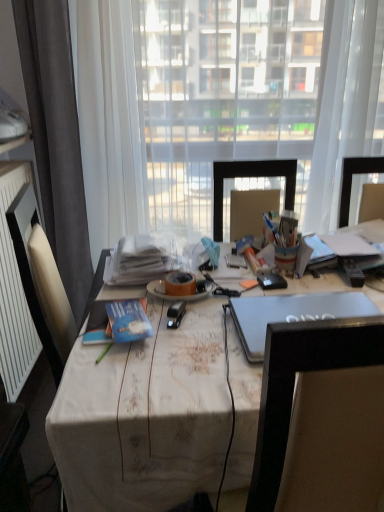
Locate an element on the screen. Image resolution: width=384 pixels, height=512 pixels. free point above orange matte plate at center (from a real-world perspective) is located at coordinates (184, 285).